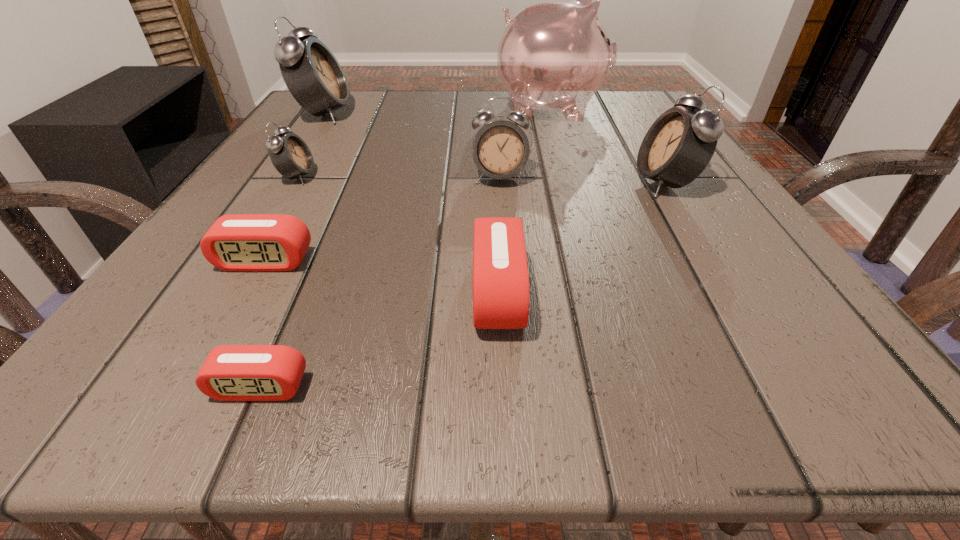
Select which white alarm clock appears as the third closest to the third smallest white alarm clock. Please provide its 2D coordinates. Your answer should be formatted as a tuple, i.e. [(x, y)], where the tuple contains the x and y coordinates of a point satisfying the conditions above.

[(314, 77)]

This screenshot has width=960, height=540. In order to click on the fourth closest white alarm clock to the piggy bank in this screenshot , I will do `click(290, 155)`.

Locate which pink alarm clock is the third closest to the piggy bank. Please provide its 2D coordinates. Your answer should be formatted as a tuple, i.e. [(x, y)], where the tuple contains the x and y coordinates of a point satisfying the conditions above.

[(230, 372)]

What are the coordinates of `pink alarm clock that is the second closest to the second biggest white alarm clock` in the screenshot? It's located at (241, 242).

Locate an element on the screen. free spot that satisfies the following two spatial constraints: 1. on the face of the third tallest object; 2. on the front-facing side of the nearest pink alarm clock is located at coordinates (788, 387).